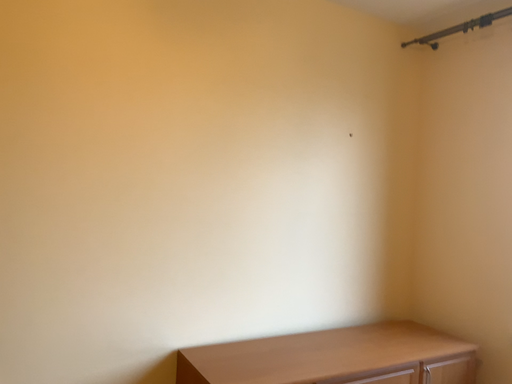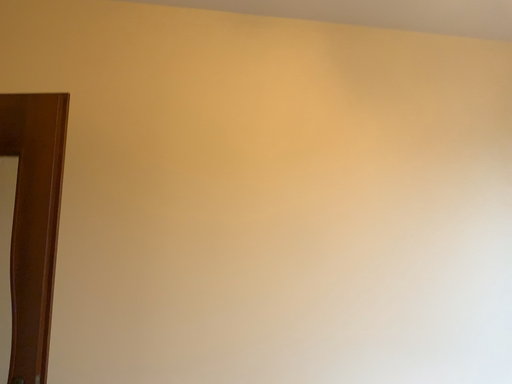
Question: Which way did the camera rotate in the video?

Choices:
 (A) rotated left
 (B) rotated right

Answer: (A)